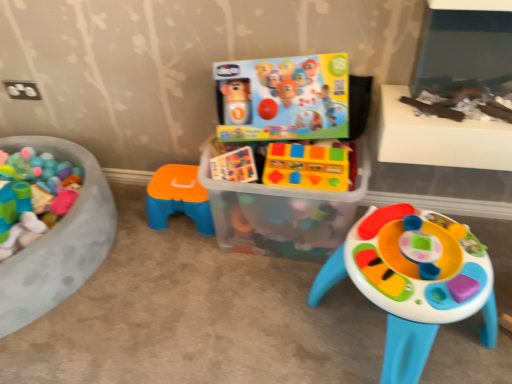
Question: From the image's perspective, is translucent plastic container at center located above or below white plastic table at upper right?

Choices:
 (A) below
 (B) above

Answer: (A)

Question: Considering the positions of point (202, 155) and point (493, 132), is point (202, 155) closer or farther from the camera than point (493, 132)?

Choices:
 (A) closer
 (B) farther

Answer: (B)

Question: Which object is the farthest from the yellow plastic toy blocks at center, arranged as the second toy when viewed from the right?

Choices:
 (A) translucent plastic container at center
 (B) white plastic table at upper right
 (C) orange plastic stool at center, which appears as the 1th toy when viewed from the left
 (D) plastic colorful activity table at center, the third toy in the left-to-right sequence

Answer: (C)

Question: Considering the real-world distances, which object is closest to the yellow plastic toy blocks at center, which is counted as the 2th toy, starting from the left?

Choices:
 (A) white plastic table at upper right
 (B) orange plastic stool at center, the third toy when ordered from right to left
 (C) translucent plastic container at center
 (D) plastic colorful activity table at center, the third toy in the left-to-right sequence

Answer: (C)